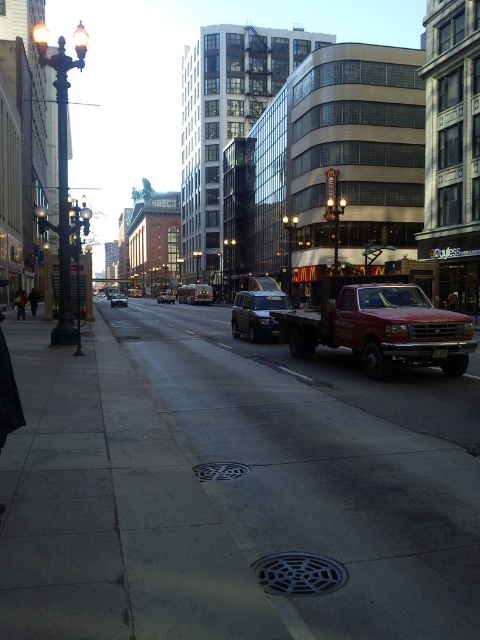
Is point (373, 317) farther from viewer compared to point (277, 332)?

No.

Does red matte truck at right have a greater width compared to matte black car at center?

No, red matte truck at right is not wider than matte black car at center.

Is point (444, 342) positioned behind point (248, 312)?

No, it is in front of (248, 312).

Where is `red matte truck at right`? red matte truck at right is located at coordinates (380, 326).

Is matte black car at center wider than silver metallic sedan at center?

Incorrect, matte black car at center's width does not surpass silver metallic sedan at center's.

Does matte black car at center appear over silver metallic sedan at center?

No.

The height and width of the screenshot is (640, 480). What are the coordinates of `matte black car at center` in the screenshot? It's located at (256, 314).

Locate an element on the screen. matte black car at center is located at coordinates (256, 314).

Is black textured grate at center closer to the viewer compared to silver metallic sedan at center?

That is True.

Does black textured grate at center appear on the left side of silver metallic sedan at center?

Incorrect, black textured grate at center is not on the left side of silver metallic sedan at center.

Which is in front, point (265, 586) or point (124, 298)?

Point (265, 586) is more forward.

Image resolution: width=480 pixels, height=640 pixels. I want to click on black textured grate at center, so click(x=299, y=573).